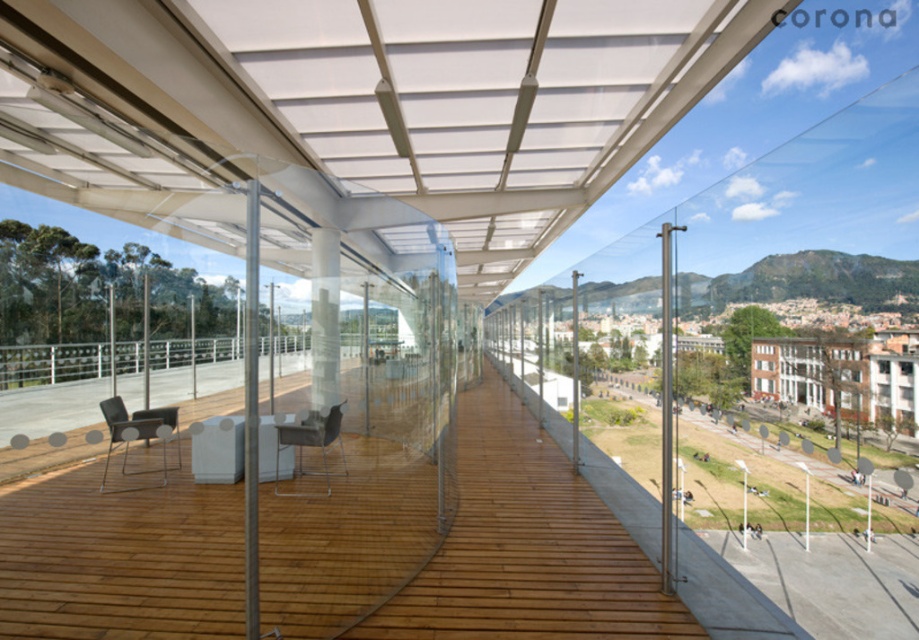
Question: Which point is closer to the camera taking this photo?

Choices:
 (A) (166, 413)
 (B) (339, 595)
 (C) (325, 422)

Answer: (B)

Question: Observing the image, what is the correct spatial positioning of matte black chair at lower left in reference to metallic silver chair at center?

Choices:
 (A) below
 (B) above

Answer: (B)

Question: Which of these objects is positioned farthest from the metallic silver chair at center?

Choices:
 (A) matte black chair at lower left
 (B) wooden deck at center

Answer: (A)

Question: Does wooden deck at center appear over metallic silver chair at center?

Choices:
 (A) yes
 (B) no

Answer: (B)

Question: Is wooden deck at center bigger than matte black chair at lower left?

Choices:
 (A) no
 (B) yes

Answer: (A)

Question: Which object appears closest to the camera in this image?

Choices:
 (A) matte black chair at lower left
 (B) metallic silver chair at center
 (C) wooden deck at center

Answer: (C)